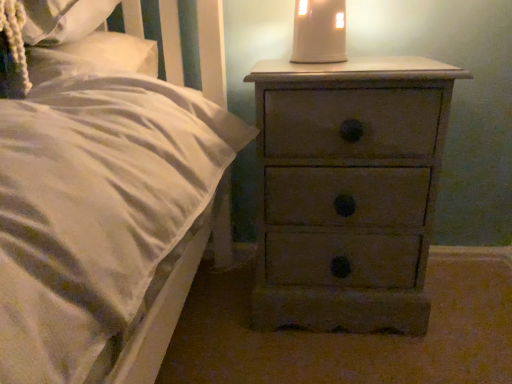
In order to click on vacant area to the right of distressed wood chest of drawers at right in this screenshot , I will do `click(468, 314)`.